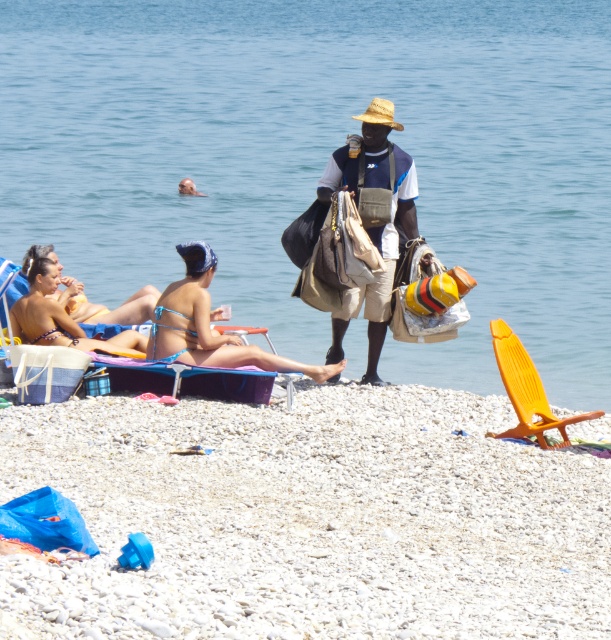
Question: Estimate the real-world distances between objects in this image. Which object is closer to the white gravel at center?

Choices:
 (A) matte bikini at center
 (B) yellow bikini at center

Answer: (A)

Question: Can you confirm if white gravel at center is wider than yellow bikini at center?

Choices:
 (A) yes
 (B) no

Answer: (A)

Question: Which point is farther from the camera taking this photo?

Choices:
 (A) (412, 230)
 (B) (37, 368)

Answer: (A)

Question: Can you confirm if clear blue water at center is smaller than white gravel at center?

Choices:
 (A) yes
 (B) no

Answer: (B)

Question: Observing the image, what is the correct spatial positioning of matte straw hat at center in reference to blue fabric beach chair at lower left?

Choices:
 (A) below
 (B) above

Answer: (B)

Question: Which point is closer to the camera?

Choices:
 (A) (147, 349)
 (B) (265, 385)
 (C) (205, 193)

Answer: (B)